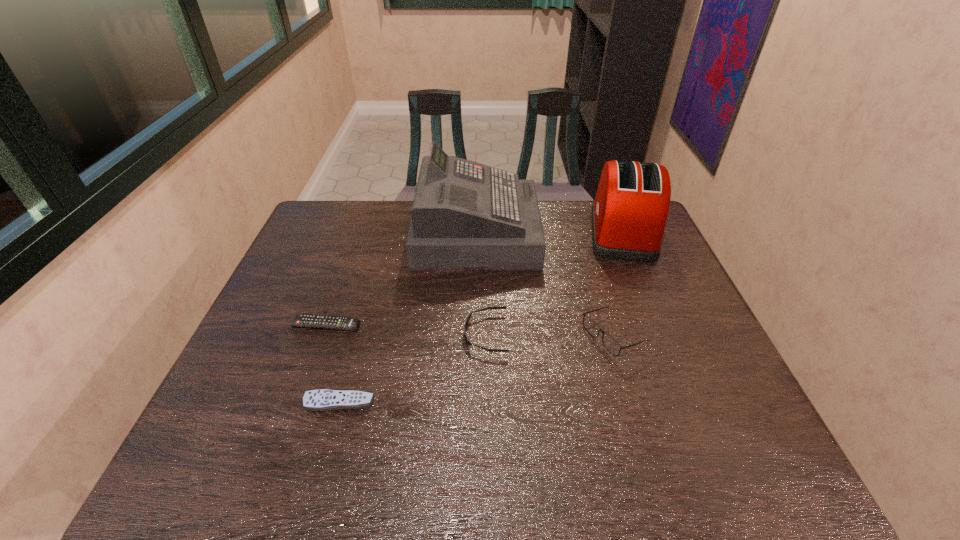
You are a GUI agent. You are given a task and a screenshot of the screen. Output one action in this format:
    pyautogui.click(x=<x>, y=<y>)
    Task: Click on the object located in the far right corner section of the desktop
    
    Given the screenshot: What is the action you would take?
    pyautogui.click(x=629, y=213)

In the image, there is a desktop. What are the coordinates of `vacant space at the far edge` in the screenshot? It's located at (371, 230).

You are a GUI agent. You are given a task and a screenshot of the screen. Output one action in this format:
    pyautogui.click(x=<x>, y=<y>)
    Task: Click on the vacant space at the left edge of the desktop
    The width and height of the screenshot is (960, 540).
    Given the screenshot: What is the action you would take?
    pyautogui.click(x=290, y=380)

In the image, there is a desktop. Where is `vacant space at the right edge`? The width and height of the screenshot is (960, 540). vacant space at the right edge is located at coordinates (698, 359).

The image size is (960, 540). Identify the location of vacant space at the near left corner. (252, 478).

At what (x,y) coordinates should I click in order to perform the action: click on free space between the farther remote control and the nearer remote control. Please return your answer as a coordinate pair (x, y). Looking at the image, I should click on pyautogui.click(x=332, y=364).

At what (x,y) coordinates should I click in order to perform the action: click on empty space that is in between the spectacles and the farther remote control. Please return your answer as a coordinate pair (x, y). Looking at the image, I should click on (469, 330).

Locate an element on the screen. The width and height of the screenshot is (960, 540). free spot between the third tallest object and the third shortest object is located at coordinates tap(549, 335).

The width and height of the screenshot is (960, 540). Find the location of `vacant space in between the spectacles and the cash register`. vacant space in between the spectacles and the cash register is located at coordinates (544, 285).

Find the location of a particular element. This screenshot has width=960, height=540. free space between the farther remote control and the cash register is located at coordinates (401, 279).